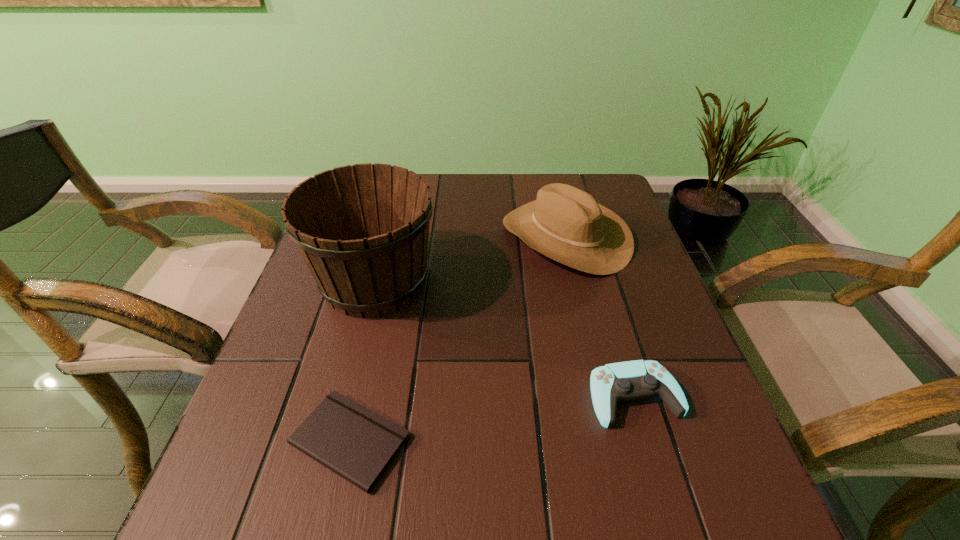
Where is `blank area in the image that satisfies the following two spatial constraints: 1. on the back side of the control; 2. on the right side of the shortest object`? blank area in the image that satisfies the following two spatial constraints: 1. on the back side of the control; 2. on the right side of the shortest object is located at coordinates (360, 397).